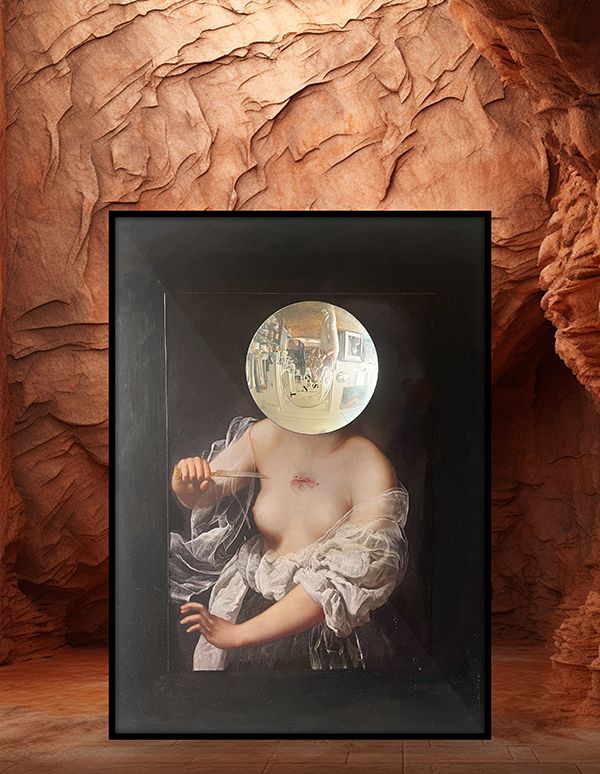
Image resolution: width=600 pixels, height=774 pixels. I want to click on brick tiles, so click(x=119, y=755), click(x=239, y=754), click(x=338, y=762), click(x=397, y=765), click(x=458, y=755), click(x=508, y=754).